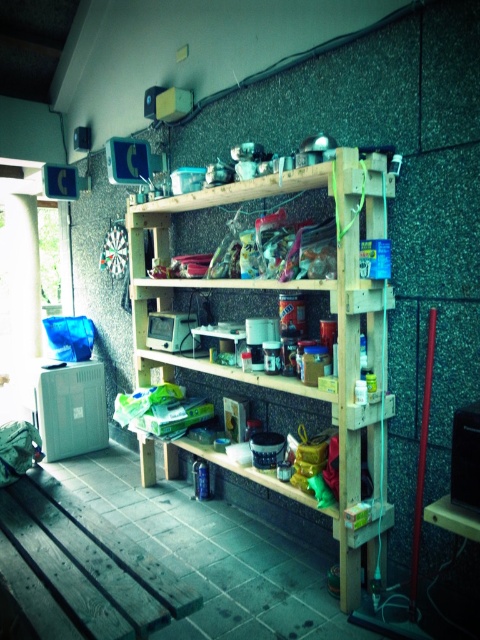
In the scene shown: Is natural wood pantry at center positioned at the back of dark wood workbench at lower left?

Yes, natural wood pantry at center is further from the viewer.

Is point (315, 387) farther from viewer compared to point (96, 589)?

Yes, point (315, 387) is farther from viewer.

Does point (179, 355) come behind point (137, 632)?

Yes, point (179, 355) is farther from viewer.

Where is `natural wood pantry at center`? natural wood pantry at center is located at coordinates (331, 312).